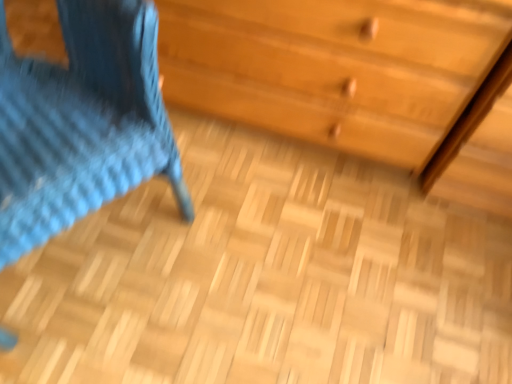
Question: Considering the relative sizes of blue knitted chair at left and wooden chest of drawers at upper right in the image provided, is blue knitted chair at left smaller than wooden chest of drawers at upper right?

Choices:
 (A) yes
 (B) no

Answer: (A)

Question: From the image's perspective, would you say blue knitted chair at left is shown under wooden chest of drawers at upper right?

Choices:
 (A) no
 (B) yes

Answer: (B)

Question: Is blue knitted chair at left bigger than wooden chest of drawers at upper right?

Choices:
 (A) no
 (B) yes

Answer: (A)

Question: From a real-world perspective, is blue knitted chair at left positioned under wooden chest of drawers at upper right based on gravity?

Choices:
 (A) no
 (B) yes

Answer: (A)

Question: Is blue knitted chair at left surrounding wooden chest of drawers at upper right?

Choices:
 (A) no
 (B) yes

Answer: (A)

Question: Considering the relative sizes of blue knitted chair at left and wooden chest of drawers at upper right in the image provided, is blue knitted chair at left wider than wooden chest of drawers at upper right?

Choices:
 (A) yes
 (B) no

Answer: (A)

Question: Is wooden chest of drawers at upper right smaller than blue knitted chair at left?

Choices:
 (A) no
 (B) yes

Answer: (A)

Question: Is wooden chest of drawers at upper right positioned behind blue knitted chair at left?

Choices:
 (A) no
 (B) yes

Answer: (B)

Question: Considering the relative sizes of wooden chest of drawers at upper right and blue knitted chair at left in the image provided, is wooden chest of drawers at upper right wider than blue knitted chair at left?

Choices:
 (A) no
 (B) yes

Answer: (A)

Question: From the image's perspective, is wooden chest of drawers at upper right under blue knitted chair at left?

Choices:
 (A) yes
 (B) no

Answer: (B)

Question: Can you confirm if wooden chest of drawers at upper right is positioned to the right of blue knitted chair at left?

Choices:
 (A) yes
 (B) no

Answer: (A)

Question: From a real-world perspective, does wooden chest of drawers at upper right sit lower than blue knitted chair at left?

Choices:
 (A) yes
 (B) no

Answer: (A)

Question: Considering their positions, is blue knitted chair at left located in front of or behind wooden chest of drawers at upper right?

Choices:
 (A) behind
 (B) front

Answer: (B)